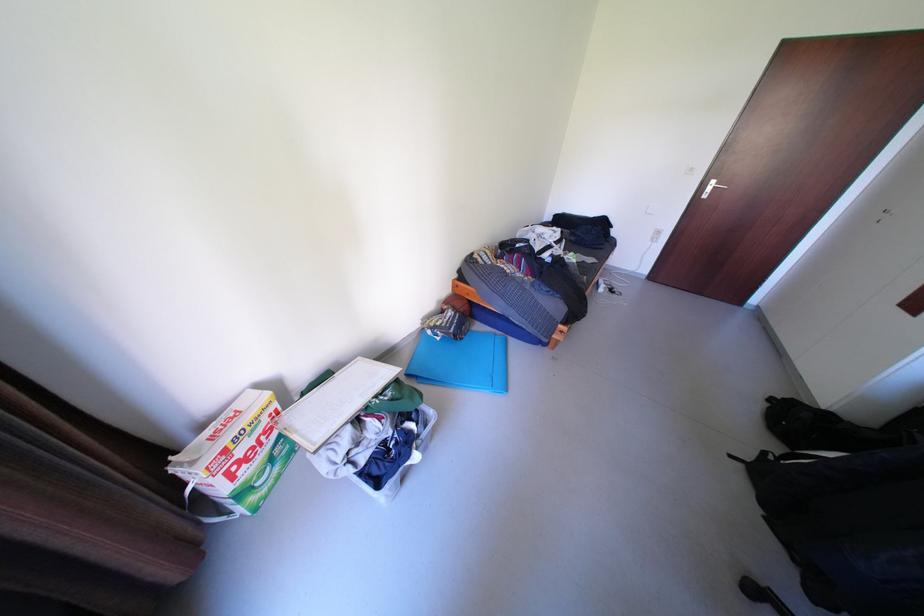
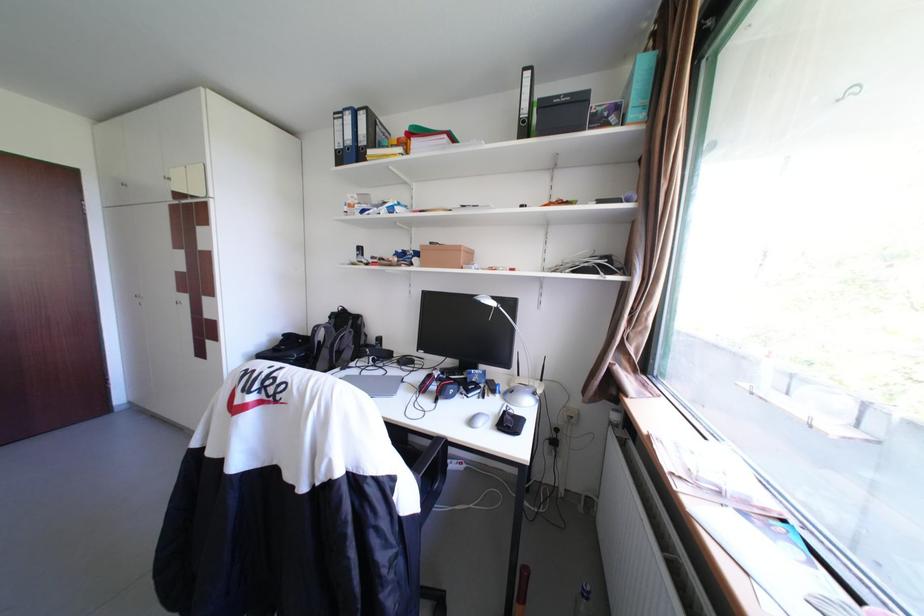
In the scene shown: How did the camera likely rotate?

The camera's rotation is toward right-down.